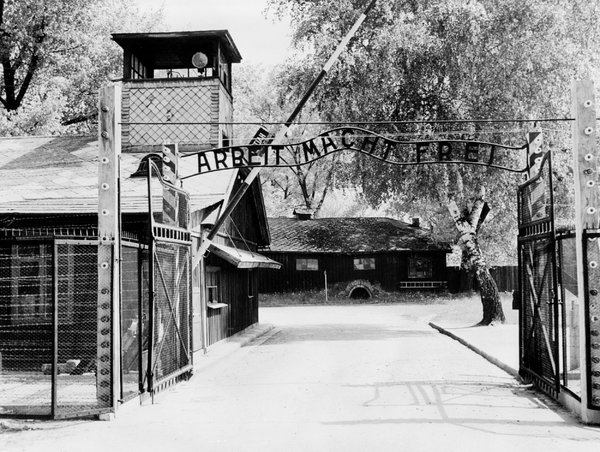
The height and width of the screenshot is (452, 600). I want to click on window, so click(215, 279), click(371, 266), click(420, 269), click(23, 293).